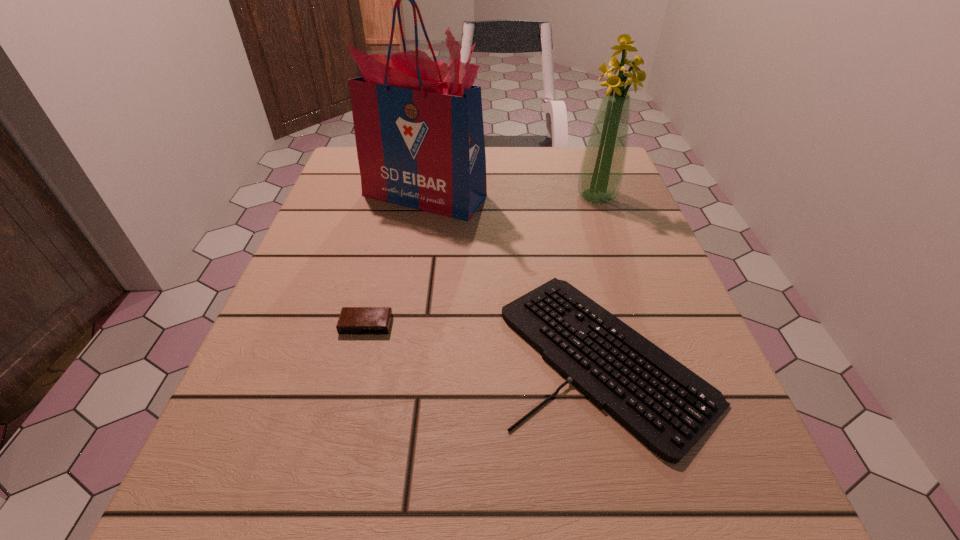
What are the coordinates of `the tallest object` in the screenshot? It's located at (418, 123).

Where is `bouquet`? Image resolution: width=960 pixels, height=540 pixels. bouquet is located at coordinates (602, 168).

This screenshot has width=960, height=540. Identify the location of alarm clock. (353, 320).

I want to click on computer keyboard, so click(x=666, y=406).

Identify the location of free region located 0.150m on the front-facing side of the tallest object. (413, 266).

At what (x,y) coordinates should I click in order to perform the action: click on vacant space situated 0.400m on the front-facing side of the bouquet. Please return your answer as a coordinate pair (x, y). Image resolution: width=960 pixels, height=540 pixels. Looking at the image, I should click on click(x=649, y=344).

I want to click on blank area located 0.110m on the front face of the alarm clock, so 349,391.

This screenshot has height=540, width=960. What are the coordinates of `free spot located on the left of the computer keyboard` in the screenshot? It's located at (405, 355).

Identify the location of grocery bag that is at the far edge. The image size is (960, 540). (418, 123).

Identify the location of bouquet that is at the far edge. (602, 168).